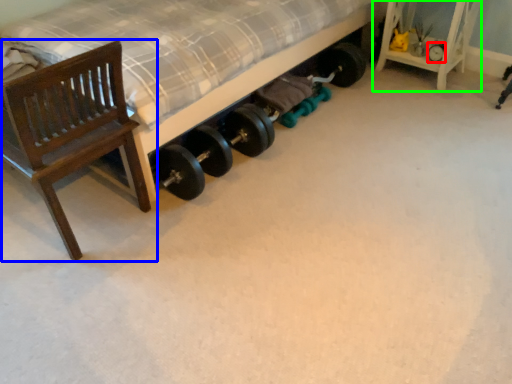
Question: Which object is positioned closest to tire (highlighted by a red box)? Select from chair (highlighted by a blue box) and furniture (highlighted by a green box).

Choices:
 (A) chair
 (B) furniture

Answer: (B)